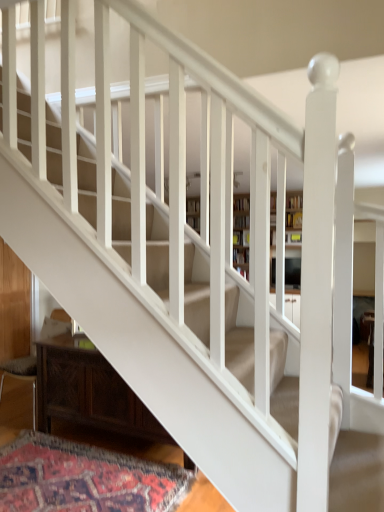
Describe the element at coordinates (84, 478) in the screenshot. I see `carpeted mat at lower left` at that location.

The image size is (384, 512). Describe the element at coordinates (241, 230) in the screenshot. I see `wooden bookcase at center` at that location.

Where is `dark wood cabinet at lower left`? dark wood cabinet at lower left is located at coordinates (89, 391).

From the picture: Which of these two, wooden armchair at lower left or wooden bookcase at center, stands shorter?

wooden armchair at lower left is shorter.

Is wooden armchair at lower left outside of wooden bookcase at center?

Yes, wooden armchair at lower left is outside of wooden bookcase at center.

Based on the photo, considering the relative sizes of wooden armchair at lower left and wooden bookcase at center in the image provided, is wooden armchair at lower left wider than wooden bookcase at center?

Indeed, wooden armchair at lower left has a greater width compared to wooden bookcase at center.

Can you tell me how much wooden armchair at lower left and carpeted mat at lower left differ in facing direction?

The angular difference between wooden armchair at lower left and carpeted mat at lower left is 178 degrees.

Which of these two, wooden armchair at lower left or carpeted mat at lower left, is bigger?

With larger size is wooden armchair at lower left.

Measure the distance between wooden armchair at lower left and carpeted mat at lower left.

wooden armchair at lower left is 33.93 inches from carpeted mat at lower left.

Can we say wooden armchair at lower left lies outside carpeted mat at lower left?

Absolutely, wooden armchair at lower left is external to carpeted mat at lower left.

In the scene shown: Considering the sizes of carpeted mat at lower left and wooden bookcase at center in the image, is carpeted mat at lower left wider or thinner than wooden bookcase at center?

In the image, carpeted mat at lower left appears to be wider than wooden bookcase at center.

Is carpeted mat at lower left positioned with its back to wooden bookcase at center?

That's not correct — carpeted mat at lower left is not looking away from wooden bookcase at center.

Find the location of a particular element. The width and height of the screenshot is (384, 512). bookcase that is behind the carpeted mat at lower left is located at coordinates tap(241, 230).

From a real-world perspective, is carpeted mat at lower left positioned above or below wooden bookcase at center?

carpeted mat at lower left is below wooden bookcase at center.

From a real-world perspective, is dark wood cabinet at lower left physically located above or below wooden armchair at lower left?

From a real-world perspective, dark wood cabinet at lower left is physically below wooden armchair at lower left.

Between dark wood cabinet at lower left and wooden armchair at lower left, which one has smaller width?

dark wood cabinet at lower left is thinner.

Looking at this image, what's the angular difference between dark wood cabinet at lower left and wooden armchair at lower left's facing directions?

The angle between the facing direction of dark wood cabinet at lower left and the facing direction of wooden armchair at lower left is 1.44 degrees.

Is wooden armchair at lower left at the back of dark wood cabinet at lower left?

No, dark wood cabinet at lower left's orientation is not away from wooden armchair at lower left.

How different are the orientations of dark wood cabinet at lower left and carpeted mat at lower left in degrees?

The angle between the facing direction of dark wood cabinet at lower left and the facing direction of carpeted mat at lower left is 177 degrees.

Is point (69, 394) closer or farther from the camera than point (13, 470)?

Clearly, point (69, 394) is more distant from the camera than point (13, 470).

Is dark wood cabinet at lower left inside the boundaries of carpeted mat at lower left, or outside?

dark wood cabinet at lower left exists outside the volume of carpeted mat at lower left.

In terms of width, does dark wood cabinet at lower left look wider or thinner when compared to carpeted mat at lower left?

dark wood cabinet at lower left is thinner than carpeted mat at lower left.

Which of these two, wooden bookcase at center or wooden armchair at lower left, is thinner?

Thinner between the two is wooden bookcase at center.

Are wooden bookcase at center and wooden armchair at lower left located far from each other?

Yes.

Can you tell me how much wooden bookcase at center and wooden armchair at lower left differ in facing direction?

2.81 degrees.

From a real-world perspective, which object rests below the other?

carpeted mat at lower left is physically lower.

Is wooden armchair at lower left surrounded by carpeted mat at lower left?

No, wooden armchair at lower left is located outside of carpeted mat at lower left.

Considering the relative sizes of carpeted mat at lower left and wooden armchair at lower left in the image provided, is carpeted mat at lower left thinner than wooden armchair at lower left?

In fact, carpeted mat at lower left might be wider than wooden armchair at lower left.

Locate an element on the screen. Image resolution: width=384 pixels, height=512 pixels. armchair below the wooden bookcase at center (from a real-world perspective) is located at coordinates (22, 375).

Locate an element on the screen. The image size is (384, 512). armchair lying on the left of carpeted mat at lower left is located at coordinates (22, 375).

From the image, which object appears to be farther from dark wood cabinet at lower left, carpeted mat at lower left or wooden bookcase at center?

The object further to dark wood cabinet at lower left is wooden bookcase at center.

Which object lies further to the anchor point dark wood cabinet at lower left, carpeted mat at lower left or wooden armchair at lower left?

The object further to dark wood cabinet at lower left is wooden armchair at lower left.

Consider the image. Which object lies further to the anchor point carpeted mat at lower left, wooden armchair at lower left or wooden bookcase at center?

Among the two, wooden bookcase at center is located further to carpeted mat at lower left.

From the image, which object appears to be nearer to carpeted mat at lower left, wooden bookcase at center or wooden armchair at lower left?

Based on the image, wooden armchair at lower left appears to be nearer to carpeted mat at lower left.

Considering their positions, is wooden armchair at lower left positioned further to wooden bookcase at center than dark wood cabinet at lower left?

wooden armchair at lower left lies further to wooden bookcase at center than the other object.

Consider the image. When comparing their distances from dark wood cabinet at lower left, does wooden bookcase at center or carpeted mat at lower left seem closer?

Based on the image, carpeted mat at lower left appears to be nearer to dark wood cabinet at lower left.

Considering their positions, is wooden armchair at lower left positioned closer to dark wood cabinet at lower left than carpeted mat at lower left?

The object closer to dark wood cabinet at lower left is carpeted mat at lower left.

From the image, which object appears to be farther from carpeted mat at lower left, dark wood cabinet at lower left or wooden armchair at lower left?

wooden armchair at lower left lies further to carpeted mat at lower left than the other object.

Find the location of a particular element. This screenshot has width=384, height=512. armchair located between dark wood cabinet at lower left and wooden bookcase at center in the depth direction is located at coordinates (22, 375).

Identify the location of armchair between carpeted mat at lower left and wooden bookcase at center along the z-axis. (22, 375).

Locate an element on the screen. The image size is (384, 512). furniture between carpeted mat at lower left and wooden bookcase at center in the front-back direction is located at coordinates (89, 391).

Find the location of a particular element. This screenshot has width=384, height=512. furniture positioned between carpeted mat at lower left and wooden armchair at lower left from near to far is located at coordinates (89, 391).